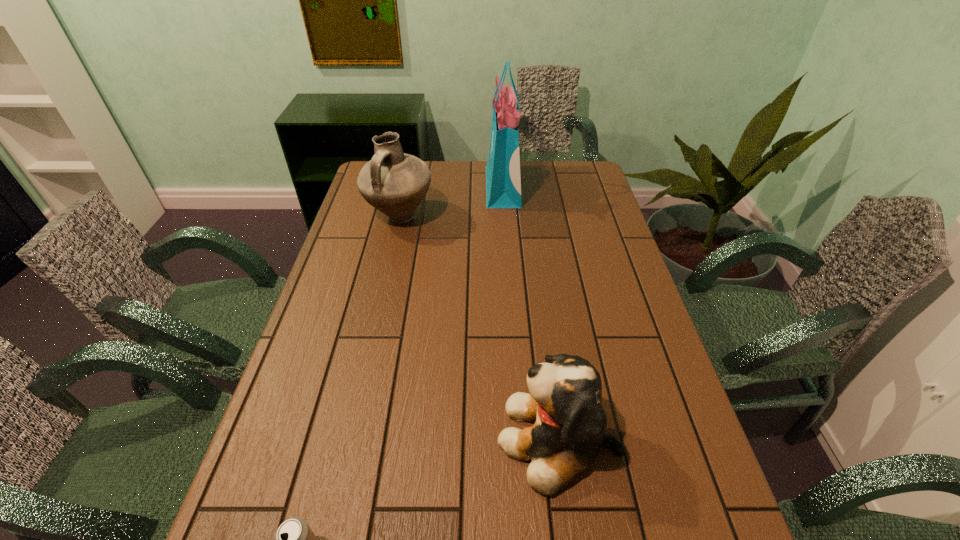
Where is `object located in the left edge section of the desktop`? The height and width of the screenshot is (540, 960). object located in the left edge section of the desktop is located at coordinates (395, 183).

Where is `object at the right edge`? This screenshot has width=960, height=540. object at the right edge is located at coordinates (565, 397).

This screenshot has height=540, width=960. I want to click on vacant area at the left edge of the desktop, so pos(343,384).

You are a GUI agent. You are given a task and a screenshot of the screen. Output one action in this format:
    pyautogui.click(x=<x>, y=<y>)
    Task: Click on the free space at the right edge
    This screenshot has width=960, height=540.
    Given the screenshot: What is the action you would take?
    pyautogui.click(x=693, y=499)

This screenshot has width=960, height=540. What are the coordinates of `vacant region between the pitcher and the tallest object` in the screenshot? It's located at (451, 202).

Locate an element on the screen. vacant area that lies between the pitcher and the tallest object is located at coordinates (451, 202).

Identify the location of unoccupied area between the second tallest object and the tallest object. This screenshot has width=960, height=540. (451, 202).

At what (x,y) coordinates should I click in order to perform the action: click on empty space that is in between the puppy and the third shortest object. Please return your answer as a coordinate pair (x, y). Looking at the image, I should click on (479, 327).

This screenshot has height=540, width=960. Identify the location of vacant region between the pitcher and the puppy. (479, 327).

Find the location of `object that is the second closest one to the third tallest object`. object that is the second closest one to the third tallest object is located at coordinates (395, 183).